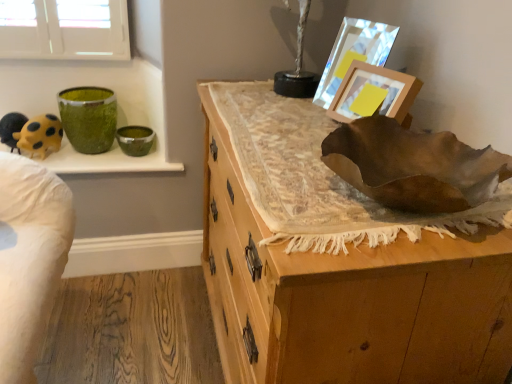
Question: Would you say green glossy bowl at upper left is outside yellow matte toy at upper left?

Choices:
 (A) yes
 (B) no

Answer: (A)

Question: Are green glossy bowl at upper left and yellow matte toy at upper left far apart?

Choices:
 (A) yes
 (B) no

Answer: (B)

Question: Does green glossy bowl at upper left appear on the left side of yellow matte toy at upper left?

Choices:
 (A) yes
 (B) no

Answer: (B)

Question: From a real-world perspective, is green glossy bowl at upper left on top of yellow matte toy at upper left?

Choices:
 (A) no
 (B) yes

Answer: (A)

Question: Considering the relative sizes of green glossy bowl at upper left and yellow matte toy at upper left in the image provided, is green glossy bowl at upper left bigger than yellow matte toy at upper left?

Choices:
 (A) no
 (B) yes

Answer: (B)

Question: Is wooden chest of drawers at center bigger or smaller than green textured vase at upper left?

Choices:
 (A) small
 (B) big

Answer: (B)

Question: Considering the positions of point (368, 240) and point (77, 135), is point (368, 240) closer or farther from the camera than point (77, 135)?

Choices:
 (A) farther
 (B) closer

Answer: (B)

Question: From the image's perspective, is wooden chest of drawers at center above or below green textured vase at upper left?

Choices:
 (A) below
 (B) above

Answer: (A)

Question: From a real-world perspective, is wooden chest of drawers at center physically located above or below green textured vase at upper left?

Choices:
 (A) below
 (B) above

Answer: (A)

Question: Is wooden picture frame at upper right, the first picture frame positioned from the front, taller or shorter than wooden chest of drawers at center?

Choices:
 (A) tall
 (B) short

Answer: (B)

Question: From the image's perspective, is wooden picture frame at upper right, the second picture frame from the back, above or below wooden chest of drawers at center?

Choices:
 (A) above
 (B) below

Answer: (A)

Question: Considering the positions of point (397, 87) and point (242, 365), is point (397, 87) closer or farther from the camera than point (242, 365)?

Choices:
 (A) closer
 (B) farther

Answer: (A)

Question: Is wooden picture frame at upper right, the second picture frame from the back, wider or thinner than wooden chest of drawers at center?

Choices:
 (A) wide
 (B) thin

Answer: (B)

Question: From the image's perspective, is wooden chest of drawers at center positioned above or below yellow matte toy at upper left?

Choices:
 (A) above
 (B) below

Answer: (B)

Question: Is wooden chest of drawers at center inside or outside of yellow matte toy at upper left?

Choices:
 (A) inside
 (B) outside

Answer: (B)